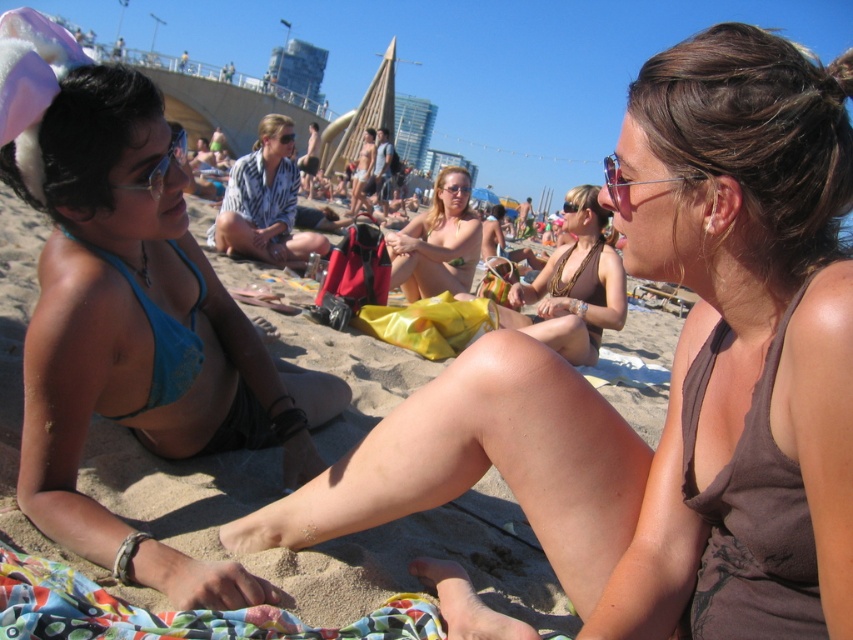
You are a photographer trying to capture a candid shot of the two women on the beach towel. Since you want to ensure the brown fabric bikini at right and the blue lace bikini top at left are both visible in the frame, which direction should you position yourself relative to the women to ensure the entire scene is captured?

To capture both the brown fabric bikini at right and the blue lace bikini top at left in the frame, position yourself to the left of the women since the brown fabric bikini at right is to the right of the blue lace bikini top at left, meaning the women are arranged from left to right with the blue lace bikini top at left first followed by the brown fabric bikini at right.

From the picture: You are standing at the beach and want to reach the point marked as point (685, 612). If your stride length is 0.75 meters, how many steps would you need to take to reach that point?

The distance between you and point (685, 612) is 1.85 meters. Since each stride covers 0.75 meters, dividing 1.85 by 0.75 gives approximately 2.47 steps. Rounding up, you would need 3 steps to reach the point.

You are a photographer trying to capture the blue fabric bikini top at left. You are currently standing at point (x=143, y=340). Can you confirm if the blue fabric bikini top at left is directly under your current position?

Yes, the blue fabric bikini top at left is located exactly at point (x=143, y=340), so it is directly under your current position.